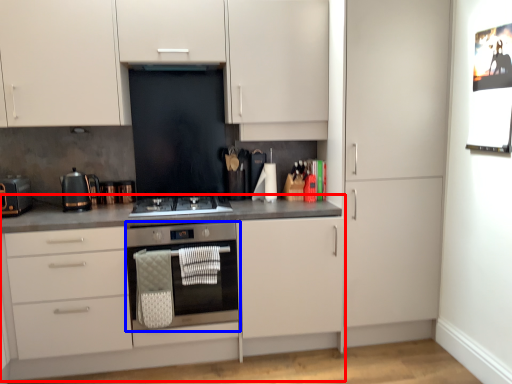
Question: Which object is further to the camera taking this photo, countertop (highlighted by a red box) or home appliance (highlighted by a blue box)?

Choices:
 (A) countertop
 (B) home appliance

Answer: (B)